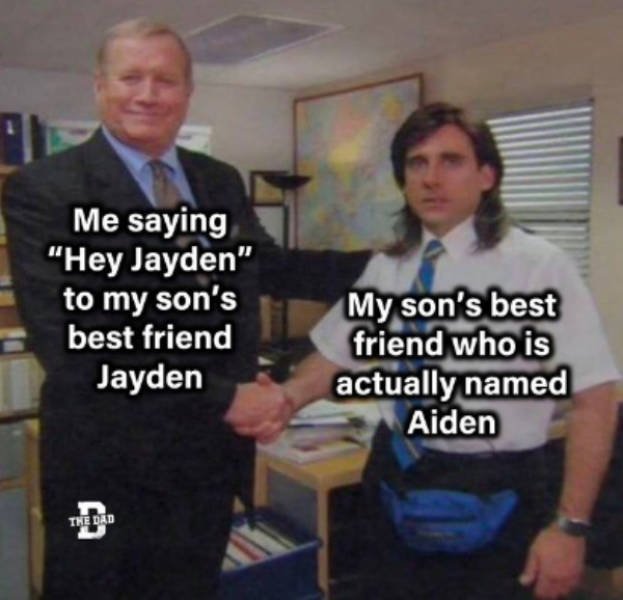
Image resolution: width=623 pixels, height=600 pixels. I want to click on blinds, so click(x=557, y=173).